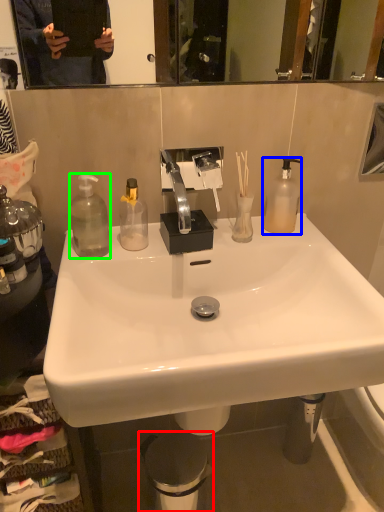
Question: Which object is the closest to the trash bin/can (highlighted by a red box)? Choose among these: bottle (highlighted by a blue box) or bottle (highlighted by a green box).

Choices:
 (A) bottle
 (B) bottle

Answer: (B)